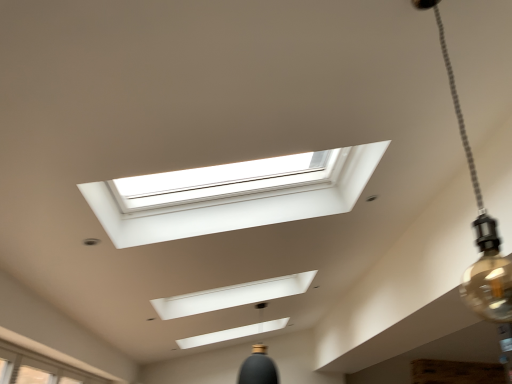
Measure the distance between white glass window at lower left and camera.

A distance of 7.80 feet exists between white glass window at lower left and camera.

What do you see at coordinates (56, 354) in the screenshot?
I see `white glass window at lower left` at bounding box center [56, 354].

Identify the location of white glass window at lower left. Image resolution: width=512 pixels, height=384 pixels. (56, 354).

Where is `matte glass bulb at upper right`? Image resolution: width=512 pixels, height=384 pixels. matte glass bulb at upper right is located at coordinates (480, 231).

What do you see at coordinates (480, 231) in the screenshot? I see `matte glass bulb at upper right` at bounding box center [480, 231].

The image size is (512, 384). What are the coordinates of `white glass window at lower left` in the screenshot? It's located at (56, 354).

Can you confirm if matte glass bulb at upper right is positioned to the left of white glass window at lower left?

No.

Does matte glass bulb at upper right come behind white glass window at lower left?

No, matte glass bulb at upper right is closer to the camera.

Which is closer, (x=440, y=35) or (x=53, y=353)?

Point (x=440, y=35) is closer to the camera than point (x=53, y=353).

From the image's perspective, is matte glass bulb at upper right under white glass window at lower left?

Incorrect, from the image's perspective, matte glass bulb at upper right is higher than white glass window at lower left.

From a real-world perspective, who is located lower, matte glass bulb at upper right or white glass window at lower left?

From a 3D spatial view, white glass window at lower left is below.

Looking at this image, in terms of width, does matte glass bulb at upper right look wider or thinner when compared to white glass window at lower left?

Considering their sizes, matte glass bulb at upper right looks slimmer than white glass window at lower left.

Does matte glass bulb at upper right have a greater height compared to white glass window at lower left?

Indeed, matte glass bulb at upper right has a greater height compared to white glass window at lower left.

Can you confirm if matte glass bulb at upper right is bigger than white glass window at lower left?

No, matte glass bulb at upper right is not bigger than white glass window at lower left.

Is matte glass bulb at upper right positioned beyond the bounds of white glass window at lower left?

Indeed, matte glass bulb at upper right is completely outside white glass window at lower left.

Is matte glass bulb at upper right beside white glass window at lower left?

matte glass bulb at upper right and white glass window at lower left are clearly separated.

Could you tell me if matte glass bulb at upper right is facing white glass window at lower left?

No.

How different are the orientations of matte glass bulb at upper right and white glass window at lower left in degrees?

matte glass bulb at upper right and white glass window at lower left are facing 0.619 degrees away from each other.

At what (x,y) coordinates should I click in order to perform the action: click on window lying below the matte glass bulb at upper right (from the image's perspective). Please return your answer as a coordinate pair (x, y). This screenshot has height=384, width=512. Looking at the image, I should click on (56, 354).

Considering the relative positions of white glass window at lower left and matte glass bulb at upper right in the image provided, is white glass window at lower left to the right of matte glass bulb at upper right from the viewer's perspective?

No.

Which object is closer to the camera taking this photo, white glass window at lower left or matte glass bulb at upper right?

matte glass bulb at upper right is more forward.

Does point (69, 355) come in front of point (481, 294)?

No, it is not.

From the image's perspective, is white glass window at lower left beneath matte glass bulb at upper right?

Yes, from the image's perspective, white glass window at lower left is beneath matte glass bulb at upper right.

From a real-world perspective, relative to matte glass bulb at upper right, is white glass window at lower left vertically above or below?

white glass window at lower left is below matte glass bulb at upper right.

Considering the relative sizes of white glass window at lower left and matte glass bulb at upper right in the image provided, is white glass window at lower left wider than matte glass bulb at upper right?

Yes.

Considering the relative sizes of white glass window at lower left and matte glass bulb at upper right in the image provided, is white glass window at lower left taller than matte glass bulb at upper right?

In fact, white glass window at lower left may be shorter than matte glass bulb at upper right.

Looking at this image, considering the relative sizes of white glass window at lower left and matte glass bulb at upper right in the image provided, is white glass window at lower left smaller than matte glass bulb at upper right?

No.

Could matte glass bulb at upper right be considered to be inside white glass window at lower left?

No, white glass window at lower left does not contain matte glass bulb at upper right.

Is white glass window at lower left far away from matte glass bulb at upper right?

Absolutely, white glass window at lower left is distant from matte glass bulb at upper right.

Is white glass window at lower left oriented towards matte glass bulb at upper right?

No, white glass window at lower left does not turn towards matte glass bulb at upper right.

How many degrees apart are the facing directions of white glass window at lower left and matte glass bulb at upper right?

There is a 0.619-degree angle between the facing directions of white glass window at lower left and matte glass bulb at upper right.

Where is `lamp on the right of white glass window at lower left`? The image size is (512, 384). lamp on the right of white glass window at lower left is located at coordinates (480, 231).

You are a GUI agent. You are given a task and a screenshot of the screen. Output one action in this format:
    pyautogui.click(x=<x>, y=<y>)
    Task: Click on the lamp that appears above the white glass window at lower left (from a real-world perspective)
    Image resolution: width=512 pixels, height=384 pixels.
    Given the screenshot: What is the action you would take?
    pyautogui.click(x=480, y=231)

Where is `window below the matte glass bulb at upper right (from a real-world perspective)`? window below the matte glass bulb at upper right (from a real-world perspective) is located at coordinates (56, 354).